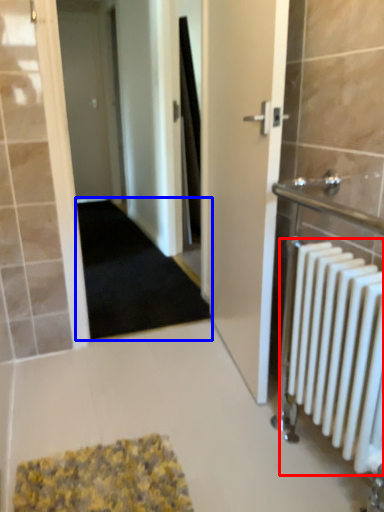
Question: Which object appears closest to the camera in this image, radiator (highlighted by a red box) or doormat (highlighted by a blue box)?

Choices:
 (A) radiator
 (B) doormat

Answer: (A)